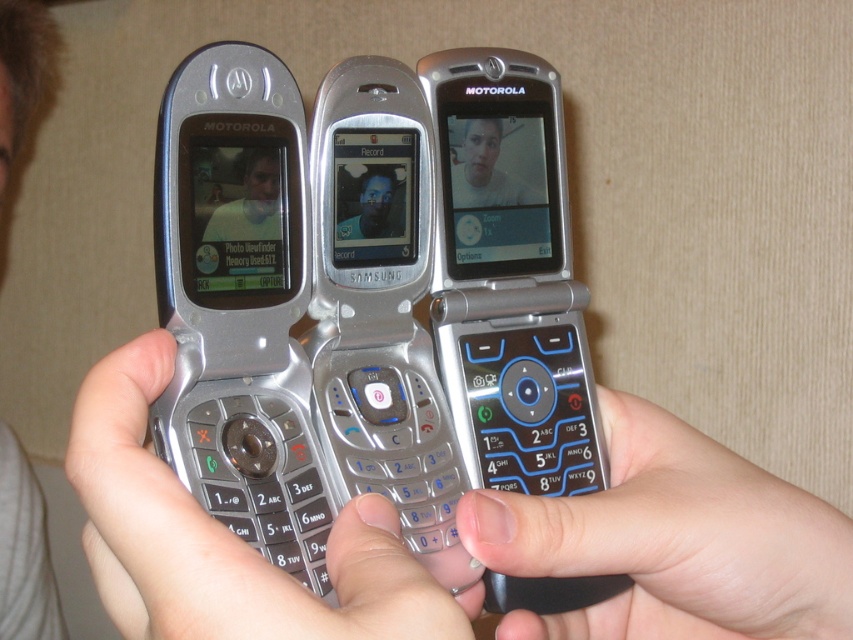
You are a photographer trying to capture the metallic silver keypad at center and the light brown hair at upper left in a single frame. Which object should you focus on to ensure both fit in the photo without cropping?

The metallic silver keypad at center is wider than the light brown hair at upper left, so focusing on the keypad will ensure both fit in the frame without cropping.

You are holding the silver metallic motorola phone at left and want to see the keypad. Can you see the metallic silver keypad at center from your current position?

The metallic silver keypad at center is behind the silver metallic motorola phone at left, so you cannot see it from your current position.

You are holding the silver metallic motorola phone at left and the metallic silver keypad at center. Which object is taller?

The silver metallic motorola phone at left is much taller than the metallic silver keypad at center.